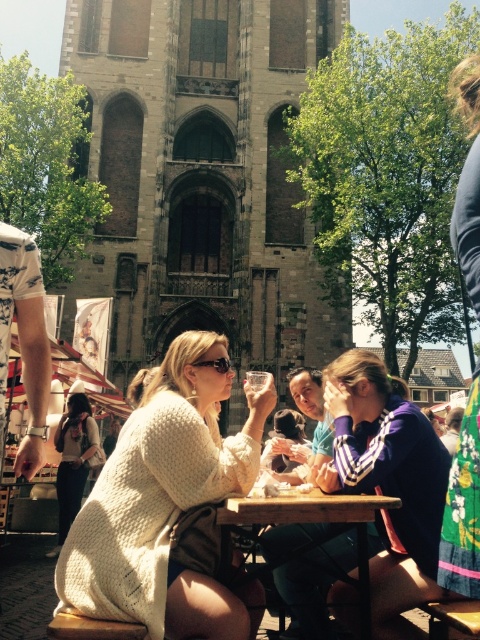
Question: Which object is closer to the camera taking this photo?

Choices:
 (A) clear glass at table center
 (B) knitted sweater at center

Answer: (A)

Question: Can you confirm if purple jersey at center is bigger than soft white sweater at center?

Choices:
 (A) no
 (B) yes

Answer: (B)

Question: Which point appears closest to the camera in this image?

Choices:
 (A) (412, 476)
 (B) (275, 468)
 (C) (268, 374)
 (D) (362, 630)

Answer: (D)

Question: Based on their relative distances, which object is farther from the purple jersey at center?

Choices:
 (A) wooden table at center
 (B) soft white sweater at center

Answer: (B)

Question: Does white knitted sweater at center appear on the right side of purple jersey at center?

Choices:
 (A) no
 (B) yes

Answer: (A)

Question: Does white knitted sweater at center appear on the left side of clear glass at table center?

Choices:
 (A) yes
 (B) no

Answer: (A)